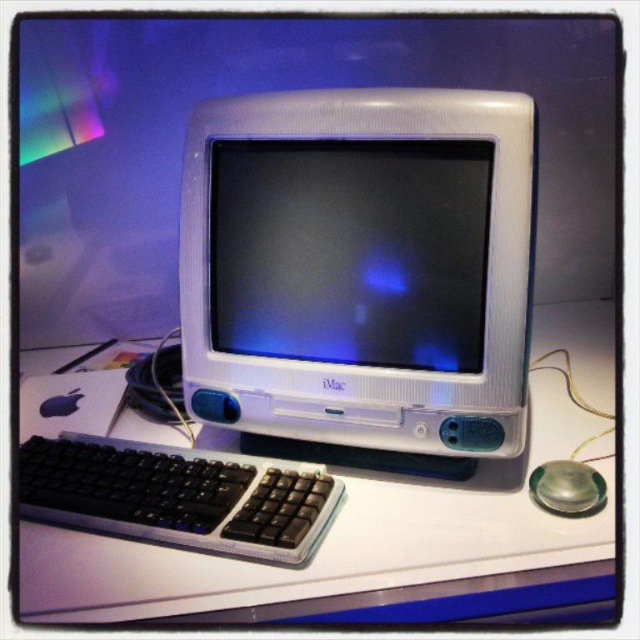
You are standing in front of the vintage iMac G3 setup. There is a point marked at coordinates (372, 524). What object is located at this point?

The white glossy computer desk at center is located at point (372, 524).

In the scene shown: You are setting up a new desk and want to place a lamp to the right of the white glossy monitor at center. Based on the current setup, where should you position the lamp relative to the monitor?

The white glossy monitor at center is located at point 0.392 on the horizontal axis and 0.548 on the vertical axis. To place the lamp to the right, position it slightly to the right of the monitor along the horizontal axis while maintaining a similar vertical position.

You are setting up a desk for a retro computing enthusiast. You have a white plastic monitor at center and a white glossy monitor at center. Which monitor should you place higher on the desk to ensure the one below is visible?

The white glossy monitor at center should be placed higher because the white plastic monitor at center is positioned under it, meaning the plastic monitor is below and thus visible when the glossy one is above.